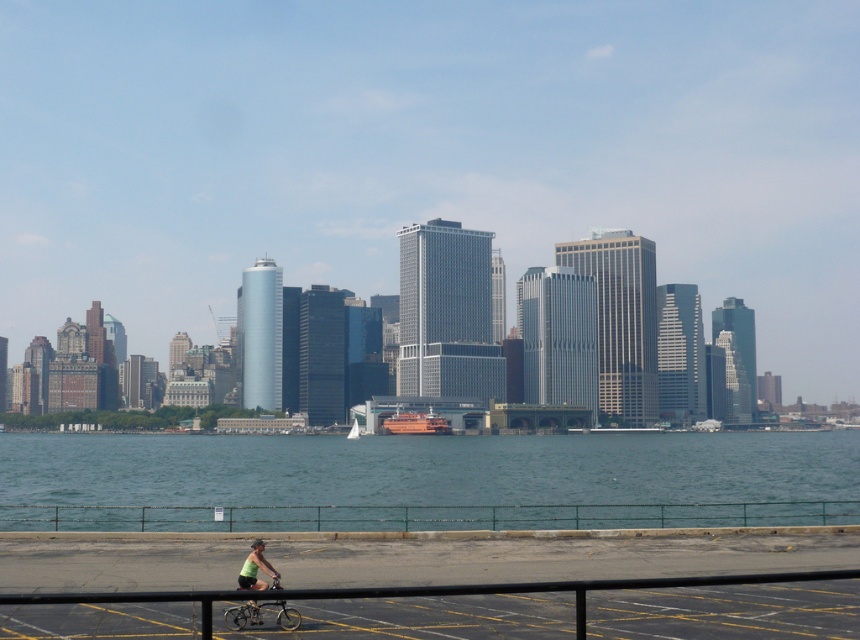
Does clear blue water at center have a greater height compared to silver metallic bicycle at lower left?

Yes, clear blue water at center is taller than silver metallic bicycle at lower left.

Between point (35, 525) and point (281, 621), which one is positioned in front?

Positioned in front is point (281, 621).

Which is behind, point (459, 474) or point (296, 611)?

Positioned behind is point (459, 474).

What are the coordinates of `clear blue water at center` in the screenshot? It's located at (427, 481).

Which of these two, clear blue water at center or green fabric shirt at lower center, stands taller?

clear blue water at center is taller.

Who is more forward, (71, 461) or (250, 563)?

Positioned in front is point (250, 563).

Where is `clear blue water at center`? clear blue water at center is located at coordinates (427, 481).

Which is in front, point (243, 605) or point (258, 564)?

Point (243, 605) is in front.

This screenshot has width=860, height=640. I want to click on silver metallic bicycle at lower left, so click(260, 614).